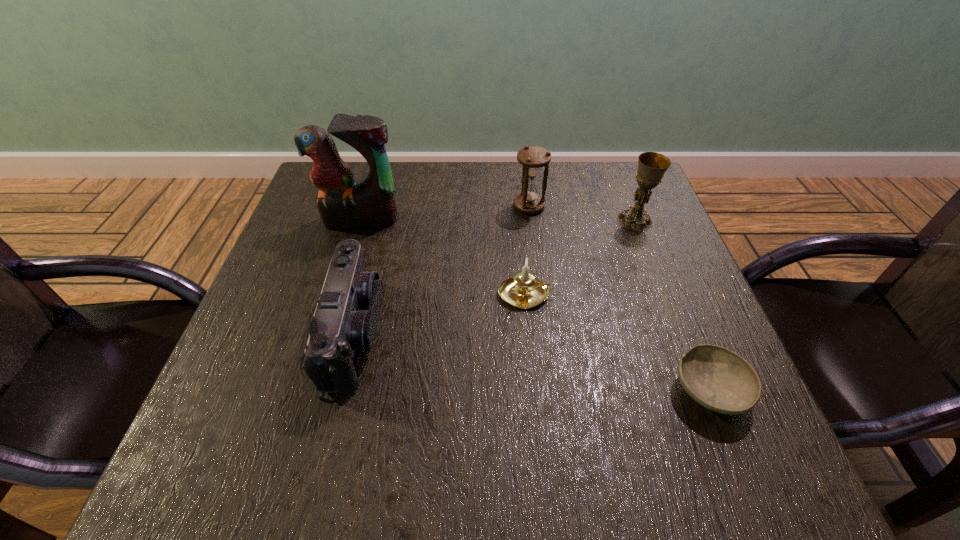
At what (x,y) coordinates should I click in order to perform the action: click on vacant position located 0.270m on the handle side of the candle holder. Please return your answer as a coordinate pair (x, y). This screenshot has height=540, width=960. Looking at the image, I should click on (688, 294).

Where is `vacant space located on the back of the bowl`? vacant space located on the back of the bowl is located at coordinates (684, 328).

Identify the location of parrot that is at the far edge. (342, 203).

Find the location of a particular element. chalice that is at the far edge is located at coordinates (652, 166).

This screenshot has width=960, height=540. Find the location of `hourglass that is at the far edge`. hourglass that is at the far edge is located at coordinates (529, 201).

I want to click on object that is at the near edge, so click(720, 380).

The image size is (960, 540). What are the coordinates of `parrot that is at the left edge` in the screenshot? It's located at (342, 203).

At what (x,y) coordinates should I click in order to perform the action: click on camcorder present at the left edge. Please return your answer as a coordinate pair (x, y). This screenshot has height=540, width=960. Looking at the image, I should click on (344, 324).

At what (x,y) coordinates should I click in order to perform the action: click on chalice positioned at the right edge. Please return your answer as a coordinate pair (x, y). This screenshot has height=540, width=960. Looking at the image, I should click on (652, 166).

Where is `bowl that is positioned at the right edge`? bowl that is positioned at the right edge is located at coordinates (720, 380).